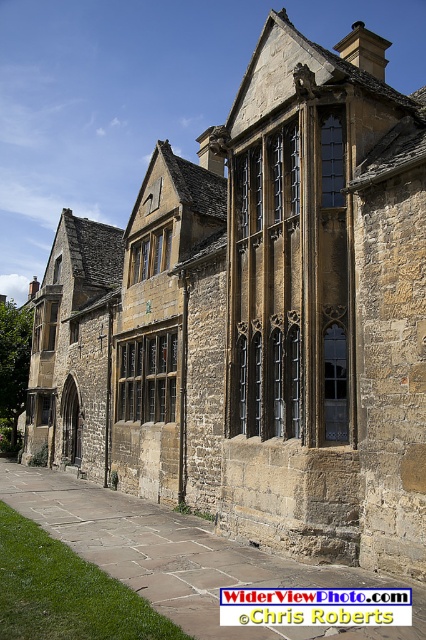
Question: Observing the image, what is the correct spatial positioning of matte stone window at center in reference to matte stone window at upper center?

Choices:
 (A) left
 (B) right

Answer: (A)

Question: Based on their relative distances, which object is farther from the matte stone window at upper center?

Choices:
 (A) dark glass window at center
 (B) matte stone window at center

Answer: (A)

Question: Does matte stone window at center have a smaller size compared to matte stone window at upper center?

Choices:
 (A) yes
 (B) no

Answer: (B)

Question: Does matte stone window at center appear on the left side of dark glass window at center?

Choices:
 (A) yes
 (B) no

Answer: (A)

Question: Estimate the real-world distances between objects in this image. Which object is closer to the dark glass window at center?

Choices:
 (A) matte stone window at upper center
 (B) matte stone window at center

Answer: (A)

Question: Which of the following is the farthest from the observer?

Choices:
 (A) (342, 188)
 (B) (149, 273)
 (C) (135, 376)

Answer: (B)